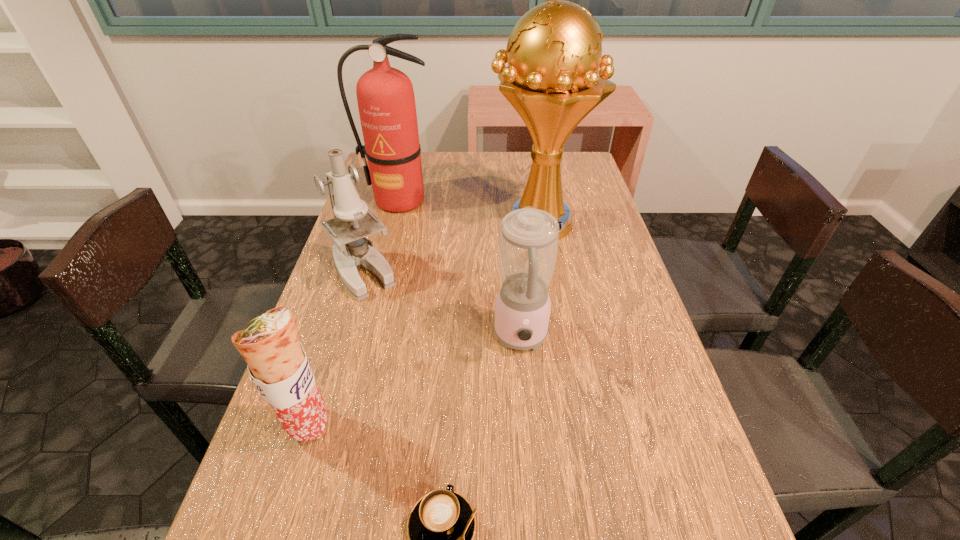
Identify the location of vacant area that lies between the fourth farthest object and the second tallest object. This screenshot has height=540, width=960. (460, 269).

The width and height of the screenshot is (960, 540). Find the location of `free space between the microscope and the burrito`. free space between the microscope and the burrito is located at coordinates (336, 349).

Identify the location of empty space between the burrito and the second tallest object. Image resolution: width=960 pixels, height=540 pixels. (353, 313).

Identify which object is located as the fifth nearest to the fire extinguisher. Please provide its 2D coordinates. Your answer should be formatted as a tuple, i.e. [(x, y)], where the tuple contains the x and y coordinates of a point satisfying the conditions above.

[(441, 526)]

Locate an element on the screen. This screenshot has width=960, height=540. object that stands as the third closest to the fifth shortest object is located at coordinates (528, 244).

Locate an element on the screen. vacant space that satisfies the following two spatial constraints: 1. at the front of the tallest object where the globe is prominent; 2. on the base of the fourth farthest object near the control knob is located at coordinates (557, 338).

What are the coordinates of `free space that satisfies the following two spatial constraints: 1. at the front of the tallest object where the globe is prominent; 2. on the base of the fourth farthest object near the control knob` in the screenshot? It's located at (557, 338).

Locate an element on the screen. The width and height of the screenshot is (960, 540). vacant space that satisfies the following two spatial constraints: 1. at the front of the trophy_cup where the globe is prominent; 2. on the base of the fourth farthest object near the control knob is located at coordinates (557, 338).

Identify the location of vacant space that satisfies the following two spatial constraints: 1. at the front of the trophy_cup where the globe is prominent; 2. on the base of the food processor near the control knob. (557, 338).